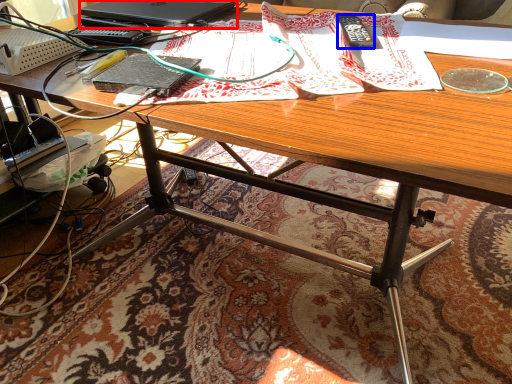
Question: Which of the following is the closest to the observer, laptop (highlighted by a red box) or remote control (highlighted by a blue box)?

Choices:
 (A) laptop
 (B) remote control

Answer: (B)